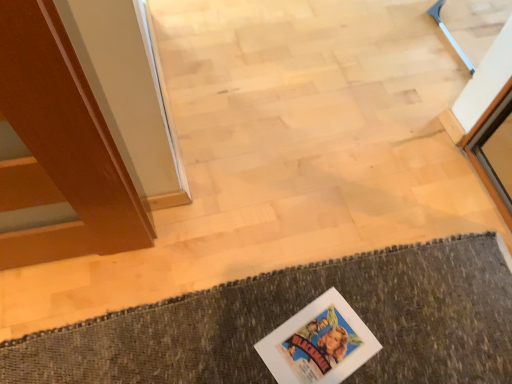
Question: Is colorful paper comic book at lower center to the right of textured wool bath mat at lower center from the viewer's perspective?

Choices:
 (A) no
 (B) yes

Answer: (B)

Question: From a real-world perspective, is colorful paper comic book at lower center physically above textured wool bath mat at lower center?

Choices:
 (A) no
 (B) yes

Answer: (B)

Question: Could you tell me if colorful paper comic book at lower center is facing textured wool bath mat at lower center?

Choices:
 (A) yes
 (B) no

Answer: (A)

Question: Is colorful paper comic book at lower center not inside textured wool bath mat at lower center?

Choices:
 (A) yes
 (B) no

Answer: (B)

Question: Considering the relative sizes of colorful paper comic book at lower center and textured wool bath mat at lower center in the image provided, is colorful paper comic book at lower center thinner than textured wool bath mat at lower center?

Choices:
 (A) no
 (B) yes

Answer: (B)

Question: From the image's perspective, is colorful paper comic book at lower center on textured wool bath mat at lower center?

Choices:
 (A) yes
 (B) no

Answer: (A)

Question: Does textured wool bath mat at lower center have a smaller size compared to colorful paper comic book at lower center?

Choices:
 (A) yes
 (B) no

Answer: (B)

Question: From the image's perspective, would you say textured wool bath mat at lower center is shown under colorful paper comic book at lower center?

Choices:
 (A) no
 (B) yes

Answer: (B)

Question: Is textured wool bath mat at lower center facing away from colorful paper comic book at lower center?

Choices:
 (A) yes
 (B) no

Answer: (A)

Question: Does textured wool bath mat at lower center have a greater height compared to colorful paper comic book at lower center?

Choices:
 (A) no
 (B) yes

Answer: (B)

Question: Does textured wool bath mat at lower center have a lesser width compared to colorful paper comic book at lower center?

Choices:
 (A) yes
 (B) no

Answer: (B)

Question: Is textured wool bath mat at lower center next to colorful paper comic book at lower center and touching it?

Choices:
 (A) yes
 (B) no

Answer: (B)

Question: Is point (252, 316) positioned closer to the camera than point (315, 309)?

Choices:
 (A) farther
 (B) closer

Answer: (B)